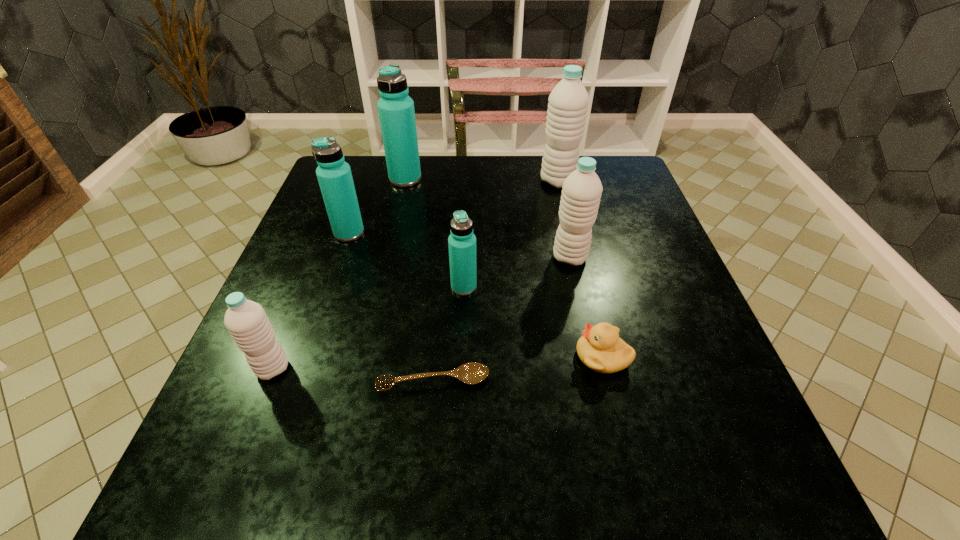
In the image, there is a desktop. Where is `vacant space at the near right corner`? vacant space at the near right corner is located at coordinates (693, 500).

Locate an element on the screen. free space between the shortest object and the third farthest water bottle is located at coordinates (392, 307).

Image resolution: width=960 pixels, height=540 pixels. In order to click on free area in between the second blue water bottle from right to left and the second nearest water bottle in this screenshot , I will do `click(435, 233)`.

Find the location of a particular element. The image size is (960, 540). vacant space that's between the farthest white water bottle and the leftmost blue water bottle is located at coordinates (453, 207).

At what (x,y) coordinates should I click in order to perform the action: click on free point between the second biggest white water bottle and the nearest water bottle. Please return your answer as a coordinate pair (x, y). This screenshot has width=960, height=540. Looking at the image, I should click on (421, 313).

You are a GUI agent. You are given a task and a screenshot of the screen. Output one action in this format:
    pyautogui.click(x=<x>, y=<y>)
    Task: Click on the free space that is in between the second farthest blue water bottle and the farthest blue water bottle
    
    Given the screenshot: What is the action you would take?
    pyautogui.click(x=377, y=206)

Where is `vacant area that lies between the third water bottle from left to right and the leftmost blue water bottle`? The image size is (960, 540). vacant area that lies between the third water bottle from left to right and the leftmost blue water bottle is located at coordinates (377, 206).

Where is `free space between the second farthest blue water bottle and the farthest white water bottle`? This screenshot has width=960, height=540. free space between the second farthest blue water bottle and the farthest white water bottle is located at coordinates click(x=453, y=207).

What are the coordinates of `empty space between the ladle and the biggest blue water bottle` in the screenshot? It's located at (420, 280).

This screenshot has width=960, height=540. Find the location of `vacant space that is in between the ladle and the fourth nearest water bottle`. vacant space that is in between the ladle and the fourth nearest water bottle is located at coordinates (392, 307).